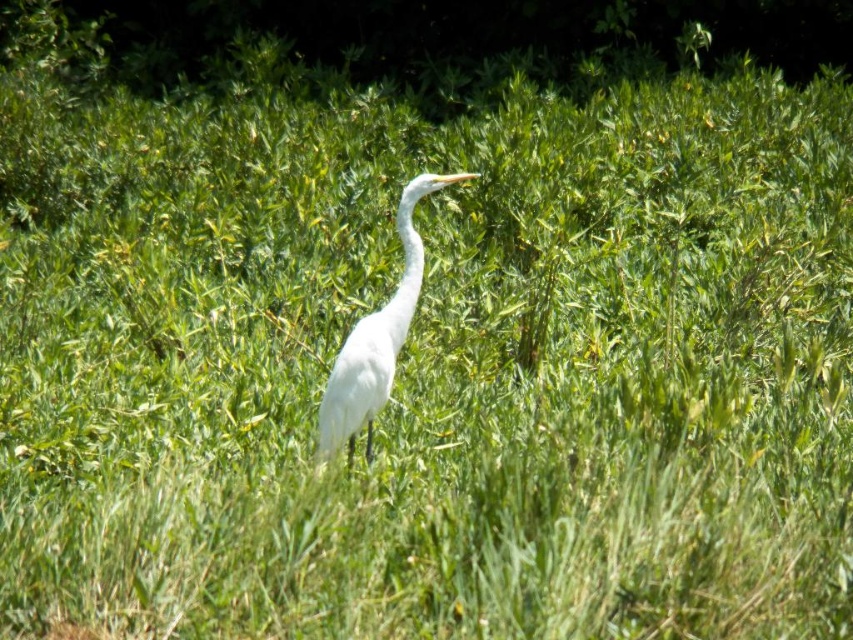
You are an ornithologist observing a white heron in its natural habitat. You notice the white smooth heron at center and the white smooth neck at center. Which of these two is larger in size?

The white smooth heron at center is bigger than the white smooth neck at center.